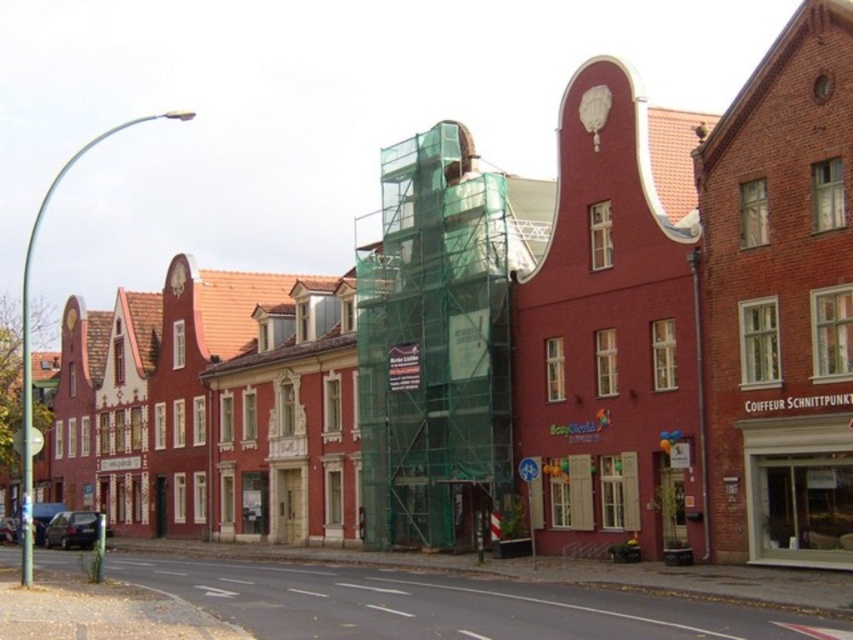
Measure the distance between matte red building at center and camera.

matte red building at center and camera are 50.75 meters apart from each other.

The height and width of the screenshot is (640, 853). In order to click on matte red building at center in this screenshot , I will do `click(614, 326)`.

Who is more forward, (x=575, y=97) or (x=393, y=435)?

Positioned in front is point (x=575, y=97).

In order to click on matte red building at center in this screenshot , I will do `click(614, 326)`.